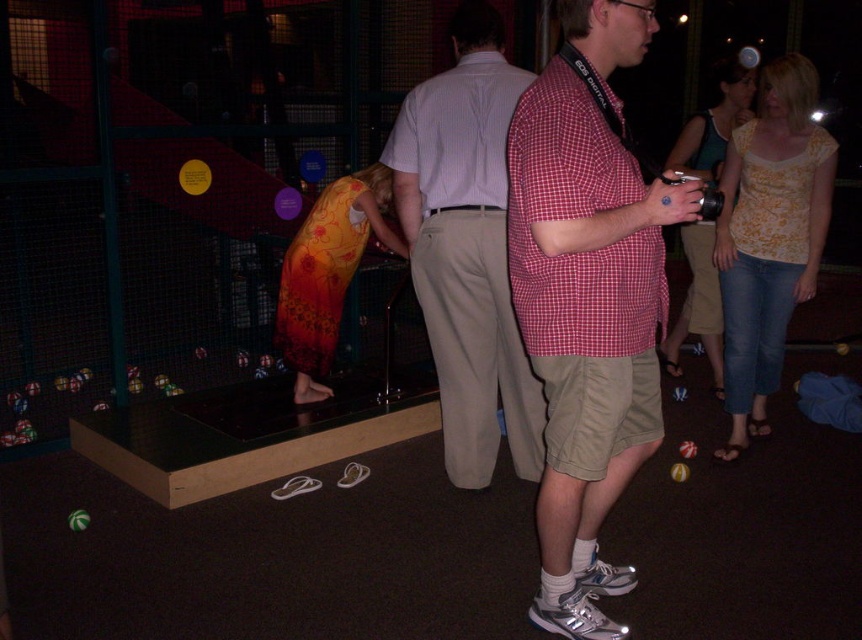
Question: Where is red checkered shirt at center located in relation to light brown cotton pants at center in the image?

Choices:
 (A) below
 (B) above

Answer: (A)

Question: Is red checkered shirt at center bigger than light brown cotton pants at center?

Choices:
 (A) yes
 (B) no

Answer: (A)

Question: Which point appears farthest from the camera in this image?

Choices:
 (A) (447, 364)
 (B) (583, 246)

Answer: (A)

Question: Does red checkered shirt at center appear under light brown cotton pants at center?

Choices:
 (A) no
 (B) yes

Answer: (B)